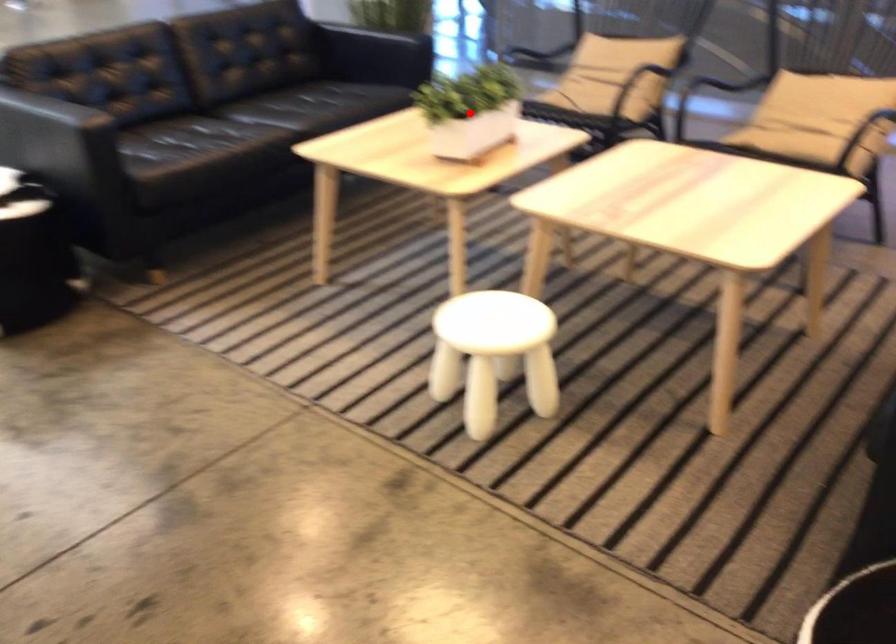
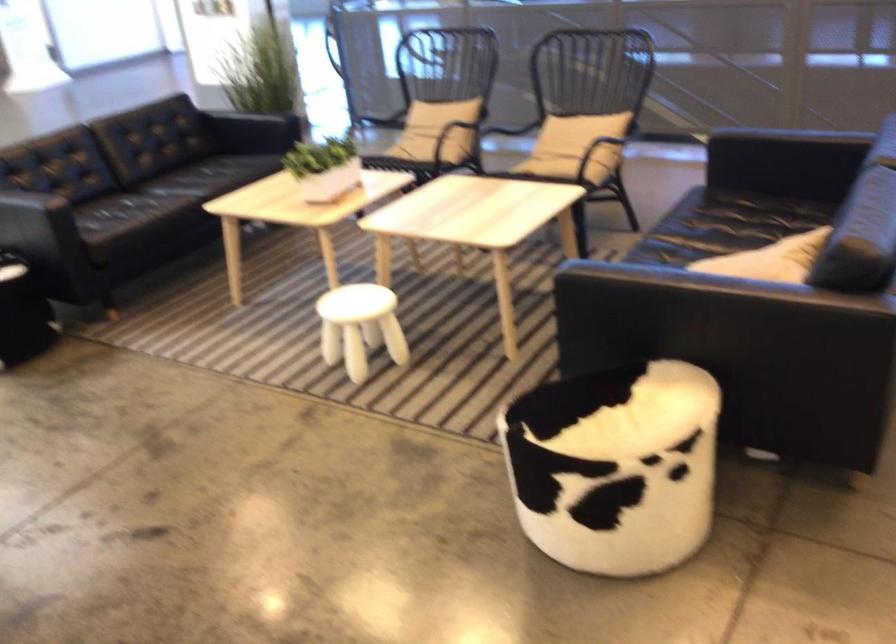
Question: I am providing you with two images of the same scene from different viewpoints. In image1, a red point is highlighted. Considering the same 3D point in image2, which of the following is correct?

Choices:
 (A) It is closer
 (B) It is farther

Answer: (B)